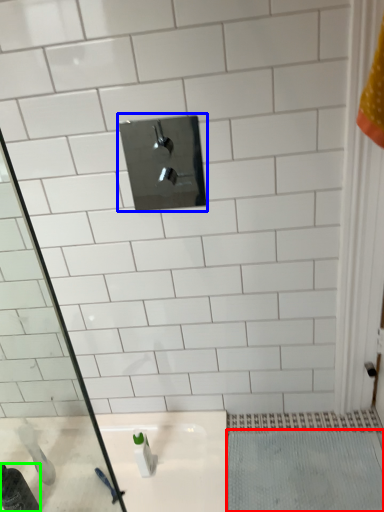
Question: Which object is the closest to the bath mat (highlighted by a red box)? Choose among these: tap (highlighted by a blue box) or bottle (highlighted by a green box).

Choices:
 (A) tap
 (B) bottle

Answer: (B)